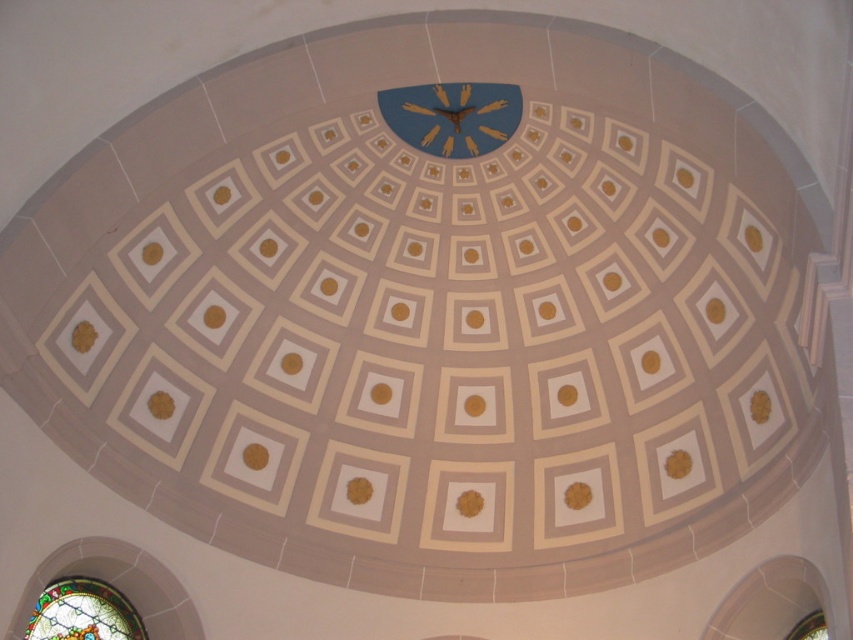
Question: Is blue matte clock at center bigger than stained glass window at lower left?

Choices:
 (A) yes
 (B) no

Answer: (A)

Question: Does blue matte clock at center appear on the right side of stained glass window at lower left?

Choices:
 (A) no
 (B) yes

Answer: (B)

Question: Does blue matte clock at center appear on the left side of stained glass window at lower left?

Choices:
 (A) yes
 (B) no

Answer: (B)